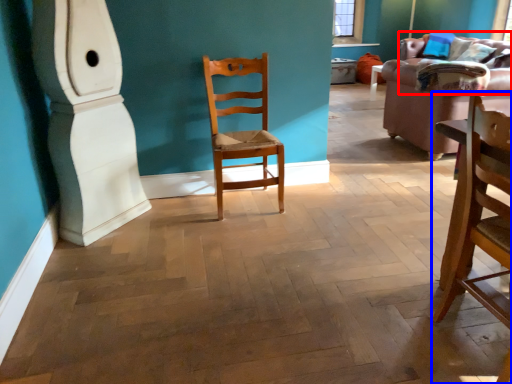
Question: Which of the following is the closest to the observer, couch (highlighted by a red box) or chair (highlighted by a blue box)?

Choices:
 (A) couch
 (B) chair

Answer: (B)